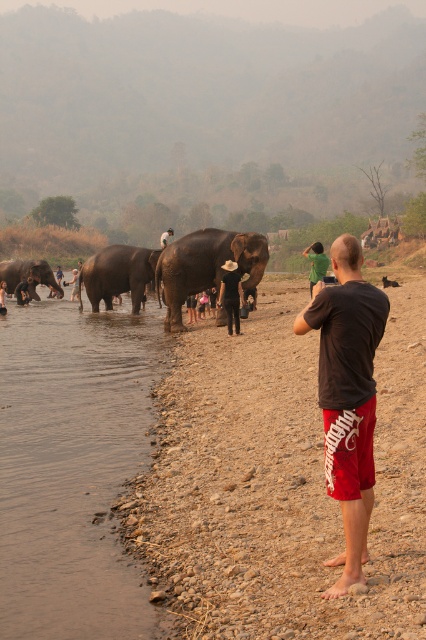
Who is positioned more to the right, dull brown gravel at lower right or brown sedimentary river at lower left?

dull brown gravel at lower right is more to the right.

Between point (307, 602) and point (26, 488), which one is positioned behind?

Positioned behind is point (26, 488).

The image size is (426, 640). Identify the location of dull brown gravel at lower right. (279, 483).

Who is taller, grayish-brown textured elephant at center or dark brown leather hat at upper center?

dark brown leather hat at upper center is taller.

Is grayish-brown textured elephant at center further to camera compared to dark brown leather hat at upper center?

No, grayish-brown textured elephant at center is closer to the viewer.

Between point (252, 269) and point (161, 236), which one is positioned behind?

The point (161, 236) is behind.

This screenshot has height=640, width=426. I want to click on grayish-brown textured elephant at center, so click(204, 266).

Which is in front, point (160, 250) or point (31, 260)?

Point (160, 250) is in front.

Is the position of dark brown textured elephant at center more distant than that of gray matte elephant at left?

That is False.

Measure the distance between dark brown textured elephant at center and camera.

dark brown textured elephant at center and camera are 22.54 meters apart.

What are the coordinates of `dark brown textured elephant at center` in the screenshot? It's located at (118, 275).